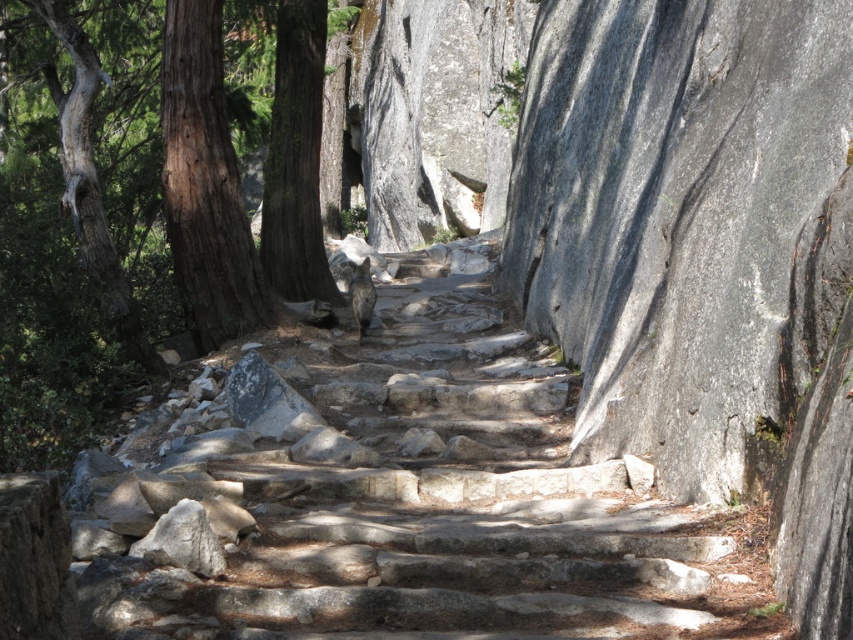
Question: Which point appears closest to the camera in this image?

Choices:
 (A) (294, 38)
 (B) (274, 224)
 (C) (242, 243)

Answer: (C)

Question: Does natural stone stairs at center appear on the left side of brown wood tree at left?

Choices:
 (A) yes
 (B) no

Answer: (B)

Question: Does brown rough bark tree at left appear over green rough bark tree at center?

Choices:
 (A) no
 (B) yes

Answer: (A)

Question: Which object is the farthest from the brown rough bark tree at left?

Choices:
 (A) natural stone stairs at center
 (B) gray textured bark tree at left
 (C) green rough bark tree at center

Answer: (C)

Question: Which point is farther to the camera?

Choices:
 (A) gray textured bark tree at left
 (B) natural stone stairs at center

Answer: (A)

Question: Does brown wood tree at left appear under green rough bark tree at center?

Choices:
 (A) yes
 (B) no

Answer: (B)